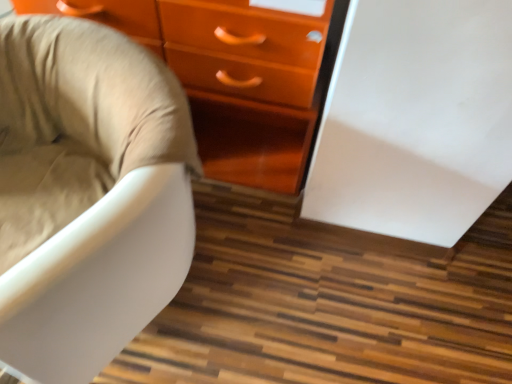
Question: Is beige fabric chair at left at the left side of glossy orange chest of drawers at center?

Choices:
 (A) yes
 (B) no

Answer: (A)

Question: Does beige fabric chair at left have a greater width compared to glossy orange chest of drawers at center?

Choices:
 (A) yes
 (B) no

Answer: (A)

Question: From the image's perspective, is beige fabric chair at left beneath glossy orange chest of drawers at center?

Choices:
 (A) no
 (B) yes

Answer: (B)

Question: Is beige fabric chair at left bigger than glossy orange chest of drawers at center?

Choices:
 (A) yes
 (B) no

Answer: (B)

Question: Could glossy orange chest of drawers at center be considered to be inside beige fabric chair at left?

Choices:
 (A) no
 (B) yes

Answer: (A)

Question: From a real-world perspective, is beige fabric chair at left over glossy orange chest of drawers at center?

Choices:
 (A) yes
 (B) no

Answer: (B)

Question: From a real-world perspective, is glossy orange chest of drawers at center on top of beige fabric chair at left?

Choices:
 (A) yes
 (B) no

Answer: (A)

Question: Considering the relative sizes of glossy orange chest of drawers at center and beige fabric chair at left in the image provided, is glossy orange chest of drawers at center taller than beige fabric chair at left?

Choices:
 (A) yes
 (B) no

Answer: (A)

Question: Is glossy orange chest of drawers at center placed right next to beige fabric chair at left?

Choices:
 (A) yes
 (B) no

Answer: (B)

Question: Is glossy orange chest of drawers at center aimed at beige fabric chair at left?

Choices:
 (A) no
 (B) yes

Answer: (B)

Question: Considering the relative sizes of glossy orange chest of drawers at center and beige fabric chair at left in the image provided, is glossy orange chest of drawers at center smaller than beige fabric chair at left?

Choices:
 (A) no
 (B) yes

Answer: (A)

Question: Does glossy orange chest of drawers at center have a larger size compared to beige fabric chair at left?

Choices:
 (A) no
 (B) yes

Answer: (B)

Question: Considering their positions, is beige fabric chair at left located in front of or behind glossy orange chest of drawers at center?

Choices:
 (A) front
 (B) behind

Answer: (A)